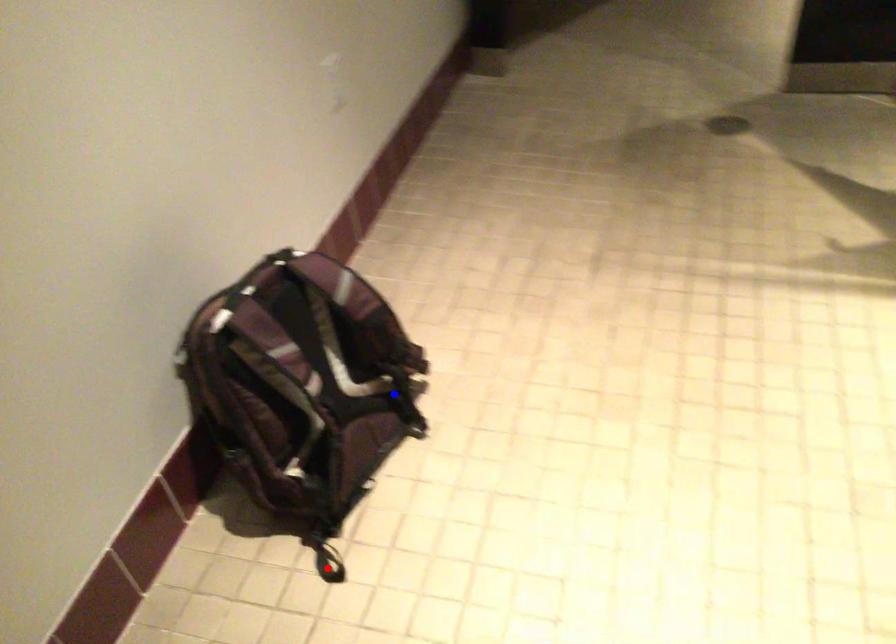
Question: Which of the two points in the image is closer to the camera?

Choices:
 (A) Blue point is closer.
 (B) Red point is closer.

Answer: (B)